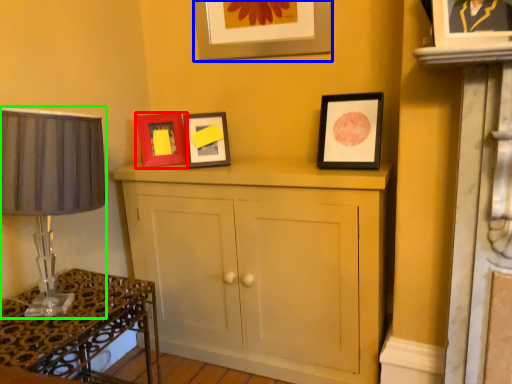
Question: Which object is the farthest from picture frame (highlighted by a red box)? Choose among these: picture frame (highlighted by a blue box) or table lamp (highlighted by a green box).

Choices:
 (A) picture frame
 (B) table lamp

Answer: (B)